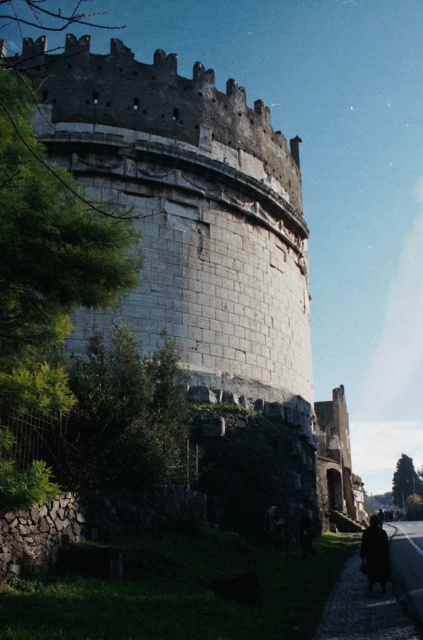
You are standing at the point marked by the coordinates point (x=200, y=221) in the image. Based on the scene described, what structure are you directly at the center of?

You are directly at the center of the white stone fort at center, as indicated by the coordinates point (x=200, y=221).

You are standing on the cobblestone path next to the white stone fort at center and want to reach the dark wool coat at lower right. Which direction should you move to get closer to the coat?

Since the white stone fort at center is closer to you than the dark wool coat at lower right, you should move forward away from the fort towards the lower right direction to reach the coat.